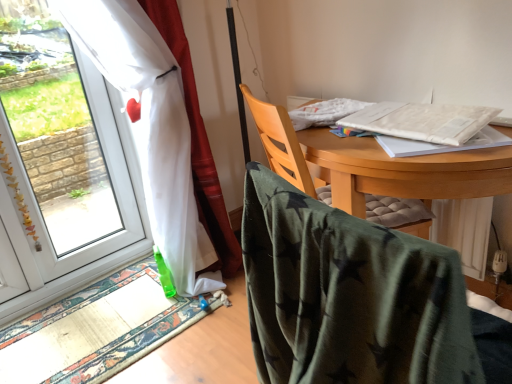
Question: Can wooden chair at center, which appears as the 2th chair when viewed from the front, be found inside green fabric mat at lower left?

Choices:
 (A) yes
 (B) no

Answer: (B)

Question: Is green fabric mat at lower left smaller than wooden chair at center, which is counted as the first chair, starting from the back?

Choices:
 (A) yes
 (B) no

Answer: (A)

Question: Does green fabric mat at lower left have a lesser height compared to wooden chair at center, which appears as the 2th chair when viewed from the front?

Choices:
 (A) no
 (B) yes

Answer: (B)

Question: Is green fabric mat at lower left oriented away from wooden chair at center, which appears as the 2th chair when viewed from the front?

Choices:
 (A) yes
 (B) no

Answer: (B)

Question: Is there a large distance between green fabric mat at lower left and wooden chair at center, which appears as the 2th chair when viewed from the front?

Choices:
 (A) yes
 (B) no

Answer: (B)

Question: From their relative heights in the image, would you say white sheer curtain at left is taller or shorter than wooden chair at center, which appears as the 2th chair when viewed from the front?

Choices:
 (A) tall
 (B) short

Answer: (A)

Question: Is point (164, 97) positioned closer to the camera than point (294, 162)?

Choices:
 (A) farther
 (B) closer

Answer: (A)

Question: Is white sheer curtain at left wider or thinner than wooden chair at center, which is counted as the first chair, starting from the back?

Choices:
 (A) wide
 (B) thin

Answer: (B)

Question: Considering the positions of white sheer curtain at left and wooden chair at center, which is counted as the first chair, starting from the back, in the image, is white sheer curtain at left bigger or smaller than wooden chair at center, which is counted as the first chair, starting from the back,?

Choices:
 (A) big
 (B) small

Answer: (A)

Question: Looking at their shapes, would you say green velvety chair at center, positioned as the 1th chair in front-to-back order, is wider or thinner than white paper at upper right, placed as the first notebook when sorted from bottom to top?

Choices:
 (A) wide
 (B) thin

Answer: (A)

Question: Is point (253, 296) closer or farther from the camera than point (396, 155)?

Choices:
 (A) farther
 (B) closer

Answer: (B)

Question: From the image's perspective, relative to white paper at upper right, placed as the first notebook when sorted from bottom to top, is green velvety chair at center, which is the 2th chair from back to front, above or below?

Choices:
 (A) above
 (B) below

Answer: (B)

Question: Considering their positions, is green velvety chair at center, which is the 2th chair from back to front, located in front of or behind white paper at upper right, placed as the first notebook when sorted from bottom to top?

Choices:
 (A) front
 (B) behind

Answer: (A)

Question: Does point (169, 258) appear closer or farther from the camera than point (31, 135)?

Choices:
 (A) closer
 (B) farther

Answer: (A)

Question: Looking at the image, does white sheer curtain at left seem bigger or smaller compared to transparent glass window at left?

Choices:
 (A) big
 (B) small

Answer: (A)